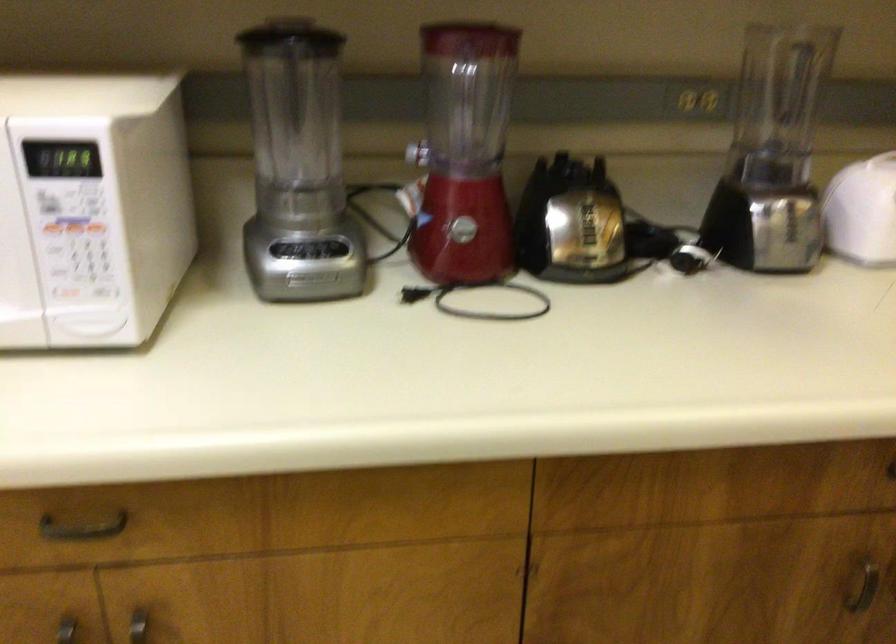
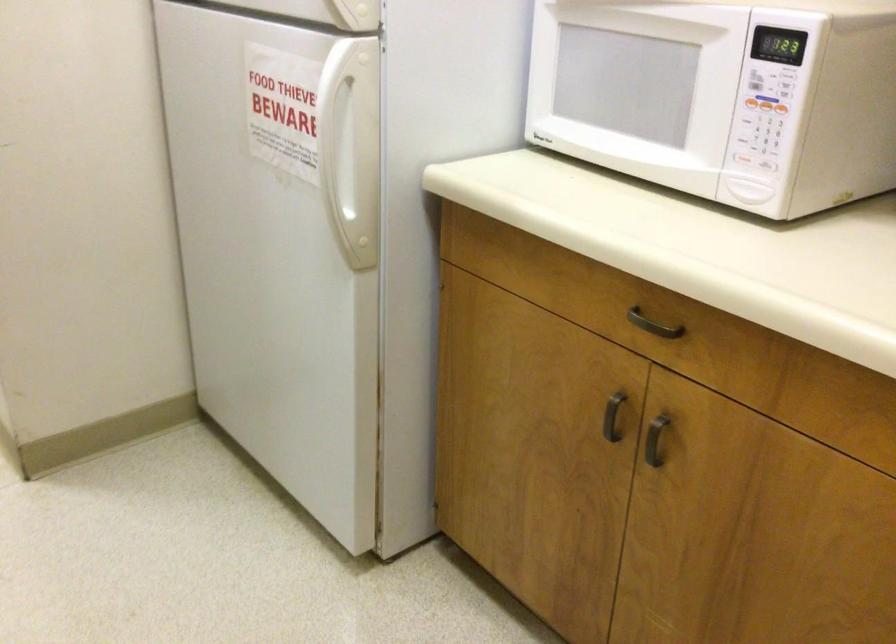
Find the pixel in the second image that matches pixel 97 230 in the first image.

(780, 108)